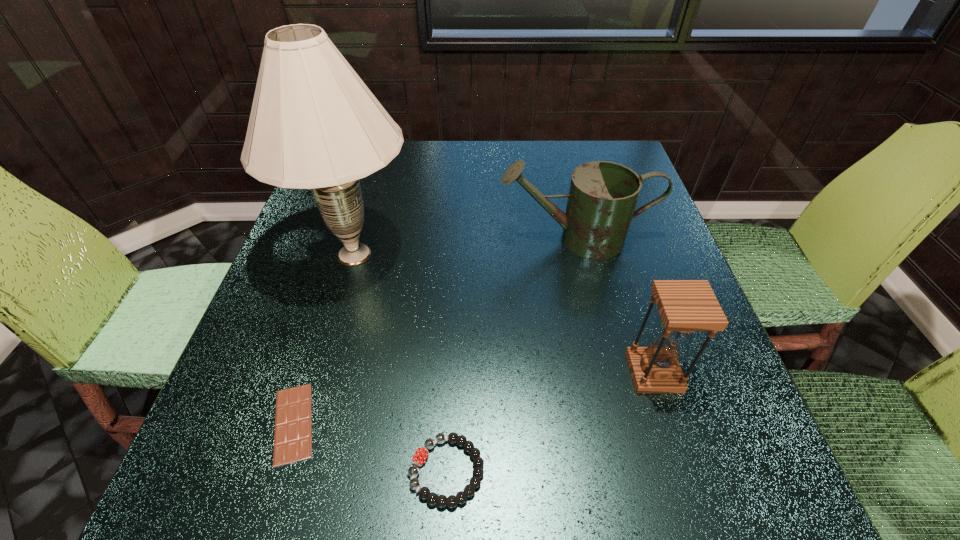
Where is `vacant area at the far edge`? This screenshot has width=960, height=540. vacant area at the far edge is located at coordinates click(x=393, y=159).

In the image, there is a desktop. Identify the location of free space at the left edge. (338, 285).

This screenshot has width=960, height=540. In the image, there is a desktop. What are the coordinates of `vacant area at the right edge` in the screenshot? It's located at (637, 225).

I want to click on free region at the near left corner of the desktop, so click(180, 485).

You are a GUI agent. You are given a task and a screenshot of the screen. Output one action in this format:
    pyautogui.click(x=<x>, y=<y>)
    Task: Click on the vacant area at the far right corner of the desktop
    The width and height of the screenshot is (960, 540).
    Given the screenshot: What is the action you would take?
    pyautogui.click(x=593, y=156)

Where is `free spot between the shortest object and the tallest object`? free spot between the shortest object and the tallest object is located at coordinates (324, 339).

Where is `empty space that is in between the lampshade and the hourglass`? empty space that is in between the lampshade and the hourglass is located at coordinates (504, 313).

The width and height of the screenshot is (960, 540). Find the location of `vacant space that's between the hourglass and the watering can`. vacant space that's between the hourglass and the watering can is located at coordinates (614, 306).

Locate an element on the screen. vacant point located between the shortest object and the watering can is located at coordinates [x=435, y=331].

This screenshot has width=960, height=540. I want to click on free spot between the tallest object and the bracelet, so click(x=400, y=362).